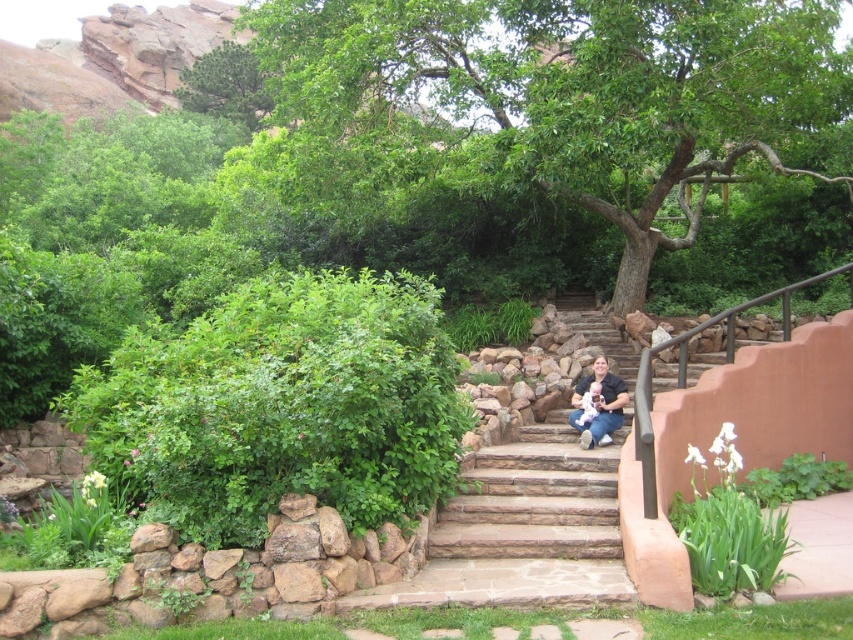
Between point (216, 97) and point (616, 384), which one is positioned in front?

Positioned in front is point (616, 384).

Is green leafy tree at upper center bigger than matte black shirt at center?

Indeed, green leafy tree at upper center has a larger size compared to matte black shirt at center.

Find the location of a particular element. The height and width of the screenshot is (640, 853). green leafy tree at upper center is located at coordinates (225, 84).

The image size is (853, 640). I want to click on green leafy tree at upper center, so click(225, 84).

Between green leafy tree at center and green leafy tree at upper center, which one is positioned lower?

green leafy tree at center is below.

Can you confirm if green leafy tree at center is positioned below green leafy tree at upper center?

Correct, green leafy tree at center is located below green leafy tree at upper center.

At what (x,y) coordinates should I click in order to perform the action: click on green leafy tree at center. Please return your answer as a coordinate pair (x, y). The width and height of the screenshot is (853, 640). Looking at the image, I should click on coord(567,97).

Where is `green leafy tree at center`? green leafy tree at center is located at coordinates (567, 97).

Does green leafy tree at center come behind matte black shirt at center?

Yes, it is behind matte black shirt at center.

Is point (459, 115) farther from camera compared to point (596, 365)?

Yes, it is.

Identify the location of green leafy tree at center. This screenshot has width=853, height=640. (567, 97).